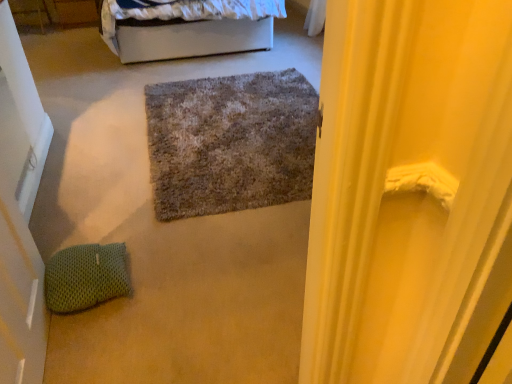
Question: From the image's perspective, is wooden drawer at upper left below white fabric bed at upper center?

Choices:
 (A) yes
 (B) no

Answer: (B)

Question: Can you confirm if wooden drawer at upper left is wider than white fabric bed at upper center?

Choices:
 (A) no
 (B) yes

Answer: (A)

Question: Is wooden drawer at upper left oriented towards white fabric bed at upper center?

Choices:
 (A) no
 (B) yes

Answer: (A)

Question: Considering the relative sizes of wooden drawer at upper left and white fabric bed at upper center in the image provided, is wooden drawer at upper left bigger than white fabric bed at upper center?

Choices:
 (A) yes
 (B) no

Answer: (B)

Question: Is wooden drawer at upper left not near white fabric bed at upper center?

Choices:
 (A) no
 (B) yes

Answer: (B)

Question: Can you confirm if wooden drawer at upper left is positioned to the right of white fabric bed at upper center?

Choices:
 (A) no
 (B) yes

Answer: (A)

Question: Are green knitted pillow at lower left and textured gray rug at center located far from each other?

Choices:
 (A) no
 (B) yes

Answer: (A)

Question: Is green knitted pillow at lower left shorter than textured gray rug at center?

Choices:
 (A) yes
 (B) no

Answer: (B)

Question: Is green knitted pillow at lower left surrounding textured gray rug at center?

Choices:
 (A) yes
 (B) no

Answer: (B)

Question: Does green knitted pillow at lower left have a smaller size compared to textured gray rug at center?

Choices:
 (A) no
 (B) yes

Answer: (B)

Question: Is green knitted pillow at lower left positioned with its back to textured gray rug at center?

Choices:
 (A) no
 (B) yes

Answer: (A)

Question: Is green knitted pillow at lower left positioned beyond the bounds of textured gray rug at center?

Choices:
 (A) no
 (B) yes

Answer: (B)

Question: Is wooden drawer at upper left bigger than white matte door at left?

Choices:
 (A) no
 (B) yes

Answer: (B)